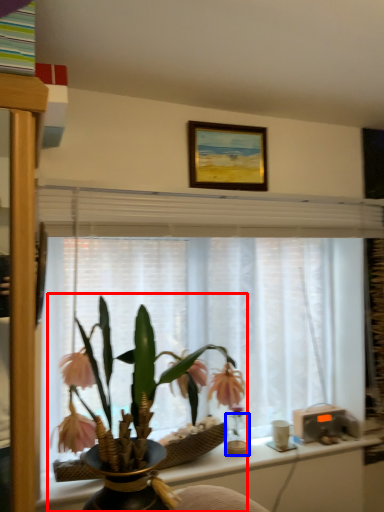
Question: Among these objects, which one is nearest to the camera, houseplant (highlighted by a red box) or glass vase (highlighted by a blue box)?

Choices:
 (A) houseplant
 (B) glass vase

Answer: (A)